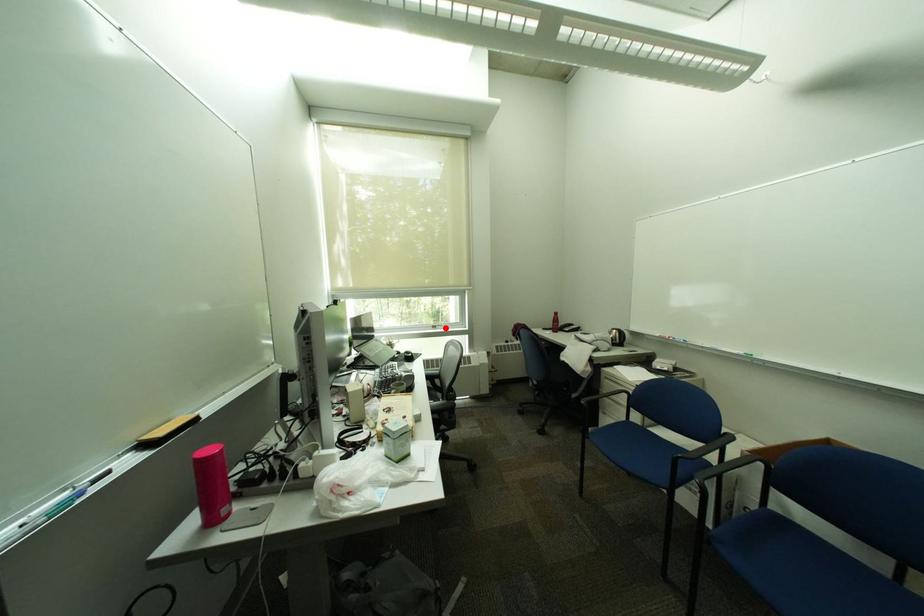
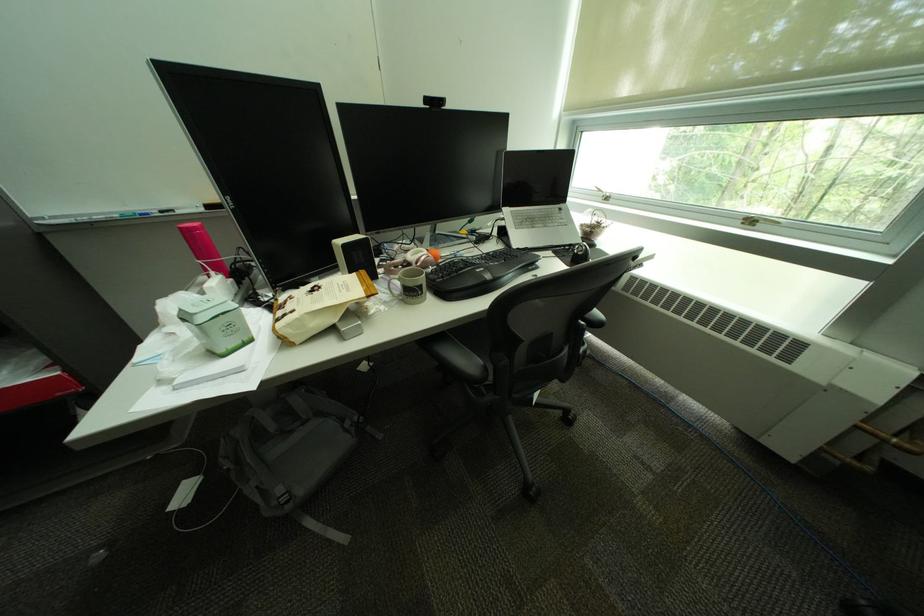
Where in the second image is the point corresponding to the highlighted location from the first image?

(761, 224)